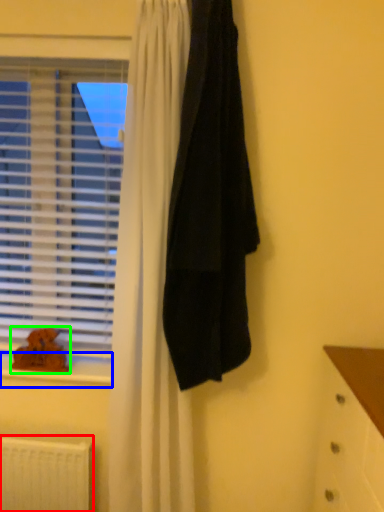
Question: Estimate the real-world distances between objects in this image. Which object is closer to radiator (highlighted by a red box), window sill (highlighted by a blue box) or animal (highlighted by a green box)?

Choices:
 (A) window sill
 (B) animal

Answer: (A)